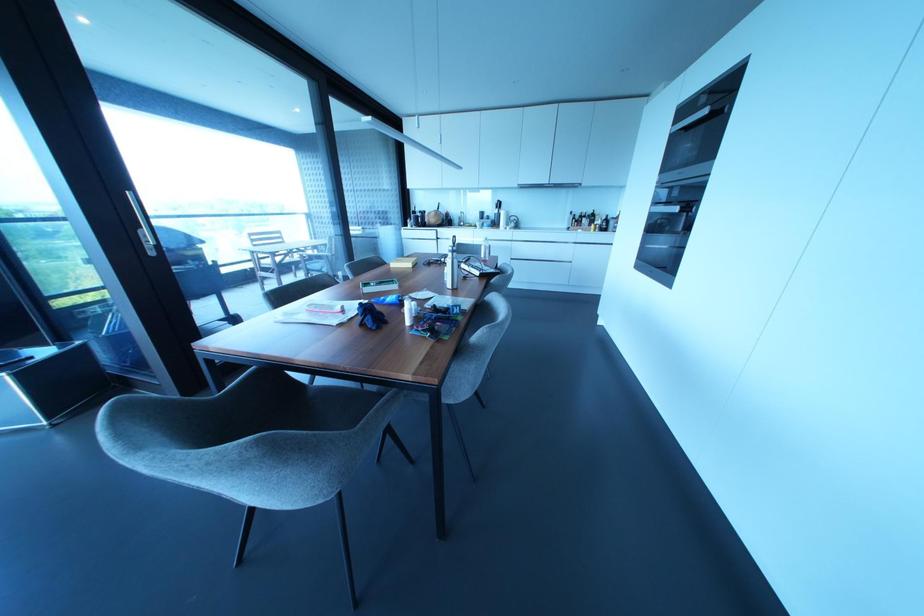
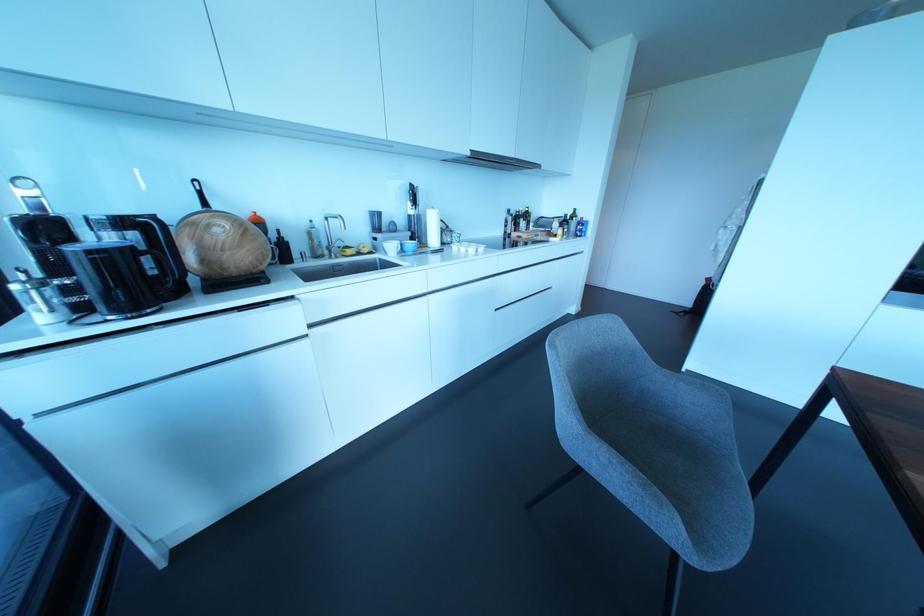
Locate, in the second image, the point that corresponds to point 481,224 in the first image.

(400, 244)